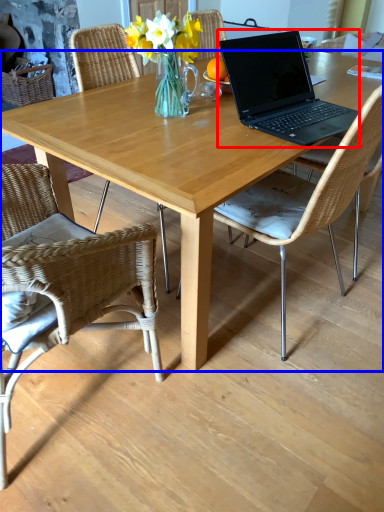
Question: Which of the following is the farthest to the observer, laptop (highlighted by a red box) or desk (highlighted by a blue box)?

Choices:
 (A) laptop
 (B) desk

Answer: (A)